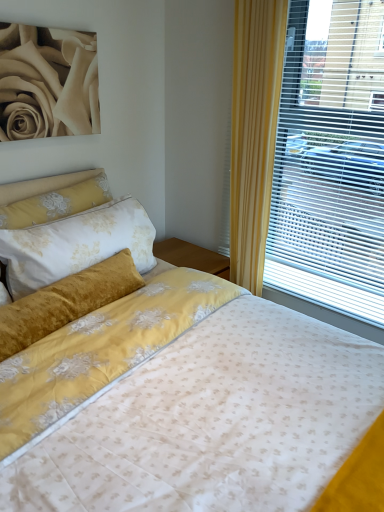
What do you see at coordinates (331, 160) in the screenshot? I see `matte blinds at right` at bounding box center [331, 160].

Where is `velvet yellow pillow at upper left`? The image size is (384, 512). velvet yellow pillow at upper left is located at coordinates (56, 203).

Is matte blinds at right facing towards matte cream rose at upper left?

No, matte blinds at right is not turned towards matte cream rose at upper left.

Does matte blinds at right touch matte cream rose at upper left?

There is a gap between matte blinds at right and matte cream rose at upper left.

Between matte blinds at right and matte cream rose at upper left, which one has smaller size?

matte cream rose at upper left is smaller.

Does point (334, 105) appear closer or farther from the camera than point (60, 188)?

Point (334, 105) is positioned closer to the camera compared to point (60, 188).

From the picture: Can you confirm if matte blinds at right is smaller than velvet yellow pillow at upper left?

No.

How far apart are matte blinds at right and velvet yellow pillow at upper left?

1.07 meters.

In the image, is matte blinds at right on the left side or the right side of velvet yellow pillow at upper left?

matte blinds at right is to the right of velvet yellow pillow at upper left.

From their relative heights in the image, would you say velvet yellow pillow at upper left is taller or shorter than matte blinds at right?

In the image, velvet yellow pillow at upper left appears to be shorter than matte blinds at right.

Can you tell me how much velvet yellow pillow at upper left and matte blinds at right differ in facing direction?

87 degrees.

Is velvet yellow pillow at upper left situated inside matte blinds at right or outside?

velvet yellow pillow at upper left is spatially situated outside matte blinds at right.

Based on the photo, looking at their sizes, would you say velvet yellow pillow at upper left is wider or thinner than matte blinds at right?

Considering their sizes, velvet yellow pillow at upper left looks broader than matte blinds at right.

From the image's perspective, is matte cream rose at upper left on matte blinds at right?

Yes, from the image's perspective, matte cream rose at upper left is above matte blinds at right.

Between matte cream rose at upper left and matte blinds at right, which one has larger size?

matte blinds at right is bigger.

Considering the sizes of objects matte cream rose at upper left and matte blinds at right in the image provided, who is wider, matte cream rose at upper left or matte blinds at right?

With larger width is matte blinds at right.

Is matte cream rose at upper left at the left side of matte blinds at right?

Yes.

From the image's perspective, which is above, matte cream rose at upper left or velvet yellow pillow at upper left?

matte cream rose at upper left is shown above in the image.

Are matte cream rose at upper left and velvet yellow pillow at upper left beside each other?

No.

In the scene shown: Does matte cream rose at upper left appear on the left side of velvet yellow pillow at upper left?

Indeed, matte cream rose at upper left is positioned on the left side of velvet yellow pillow at upper left.

Is matte cream rose at upper left thinner than velvet yellow pillow at upper left?

Indeed, matte cream rose at upper left has a lesser width compared to velvet yellow pillow at upper left.

Is velvet yellow pillow at upper left aimed at matte cream rose at upper left?

No, velvet yellow pillow at upper left does not turn towards matte cream rose at upper left.

Does velvet yellow pillow at upper left have a smaller size compared to matte cream rose at upper left?

No, velvet yellow pillow at upper left is not smaller than matte cream rose at upper left.

Which is closer to the camera, (107,187) or (64,48)?

Point (107,187) is farther from the camera than point (64,48).

Identify the location of rose above the velvet yellow pillow at upper left (from the image's perspective). (47, 83).

In order to click on rose that is behind the matte blinds at right in this screenshot , I will do `click(47, 83)`.

What are the coordinates of `window that appears on the right of velvet yellow pillow at upper left` in the screenshot? It's located at (331, 160).

Looking at this image, looking at the image, which one is located further to velvet yellow pillow at upper left, matte cream rose at upper left or matte blinds at right?

matte blinds at right is positioned further to the anchor velvet yellow pillow at upper left.

Based on their spatial positions, is matte blinds at right or velvet yellow pillow at upper left further from matte cream rose at upper left?

matte blinds at right lies further to matte cream rose at upper left than the other object.

Based on their spatial positions, is matte cream rose at upper left or velvet yellow pillow at upper left further from matte blinds at right?

matte cream rose at upper left lies further to matte blinds at right than the other object.

Based on their spatial positions, is matte blinds at right or matte cream rose at upper left closer to velvet yellow pillow at upper left?

matte cream rose at upper left lies closer to velvet yellow pillow at upper left than the other object.

Based on their spatial positions, is velvet yellow pillow at upper left or matte cream rose at upper left closer to matte blinds at right?

velvet yellow pillow at upper left.

From the image, which object appears to be nearer to matte cream rose at upper left, velvet yellow pillow at upper left or matte blinds at right?

velvet yellow pillow at upper left is closer to matte cream rose at upper left.

The image size is (384, 512). I want to click on pillow between matte cream rose at upper left and matte blinds at right, so click(x=56, y=203).